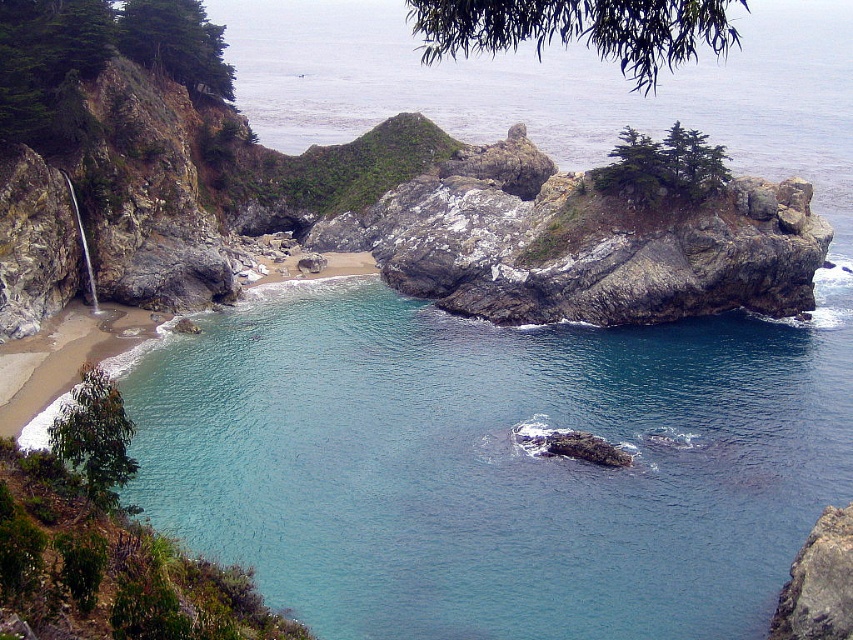
Can you confirm if clear blue water at center is thinner than rocky cliff at lower right?

Incorrect, clear blue water at center's width is not less than rocky cliff at lower right's.

Identify the location of clear blue water at center. 494,461.

This screenshot has width=853, height=640. In order to click on clear blue water at center in this screenshot , I will do `click(494, 461)`.